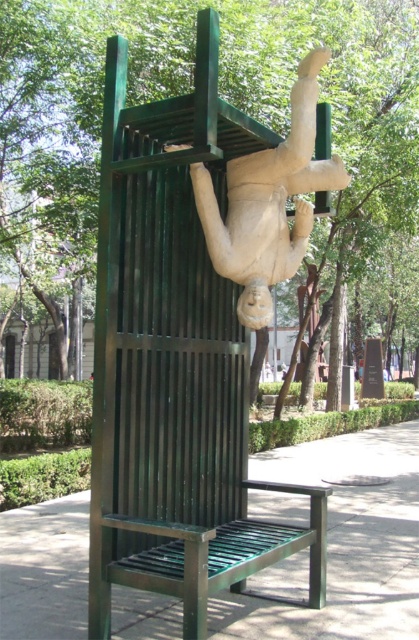
You are a visitor standing in front of the sculpture. You want to take a photo of the green metallic tree at upper center and the green metal bench at center without any obstructions. Which object should you move to ensure both are visible in the photo?

You should move the green metal bench at center because it is behind the green metallic tree at upper center and blocking the view of the tree. Moving the bench would allow both objects to be visible without obstruction.

You are standing in the park and want to take a photo of the sculpture. You notice a point labeled as point [178,92] in your map. What object is located at this coordinate?

The point [178,92] corresponds to the green metallic tree at upper center.